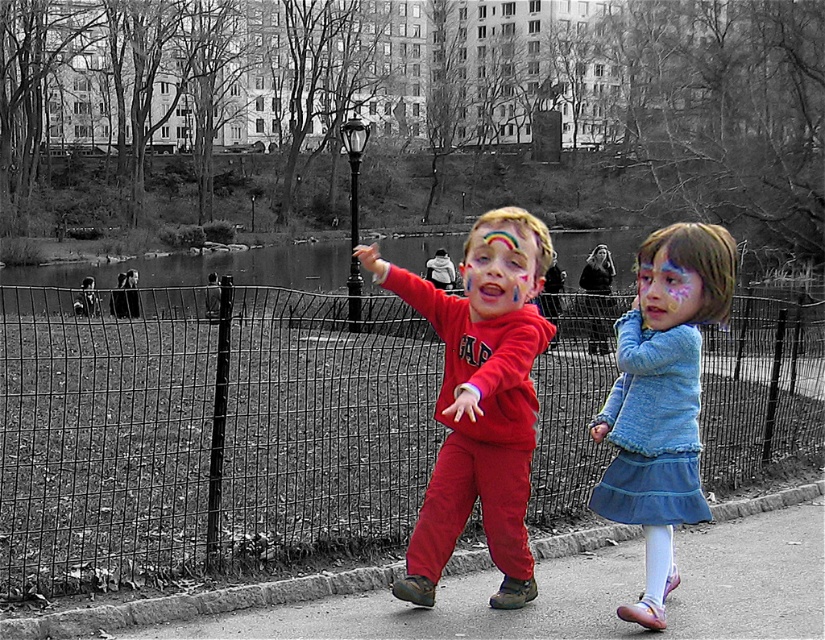
Between black wire fence at center and rainbow painted face at center, which one is positioned lower?

rainbow painted face at center

Does point (133, 525) come behind point (510, 243)?

Yes, it is.

At what (x,y) coordinates should I click in order to perform the action: click on black wire fence at center. Please return your answer as a coordinate pair (x, y). This screenshot has height=640, width=825. Looking at the image, I should click on (205, 433).

The height and width of the screenshot is (640, 825). What are the coordinates of `smooth asphalt road at center` in the screenshot? It's located at (453, 609).

Based on the photo, who is positioned more to the left, smooth asphalt road at center or pastel painted face at center?

pastel painted face at center

Between point (234, 634) and point (695, 289), which one is positioned in front?

Positioned in front is point (695, 289).

In order to click on smooth asphalt road at center in this screenshot , I will do `click(453, 609)`.

Is velvet red hoodie at center wider than blue knit sweater at center?

Correct, the width of velvet red hoodie at center exceeds that of blue knit sweater at center.

How distant is velvet red hoodie at center from blue knit sweater at center?

33.80 inches

Is point (498, 397) closer to viewer compared to point (712, 260)?

Yes, point (498, 397) is closer to viewer.

Where is `velvet red hoodie at center`? velvet red hoodie at center is located at coordinates (479, 400).